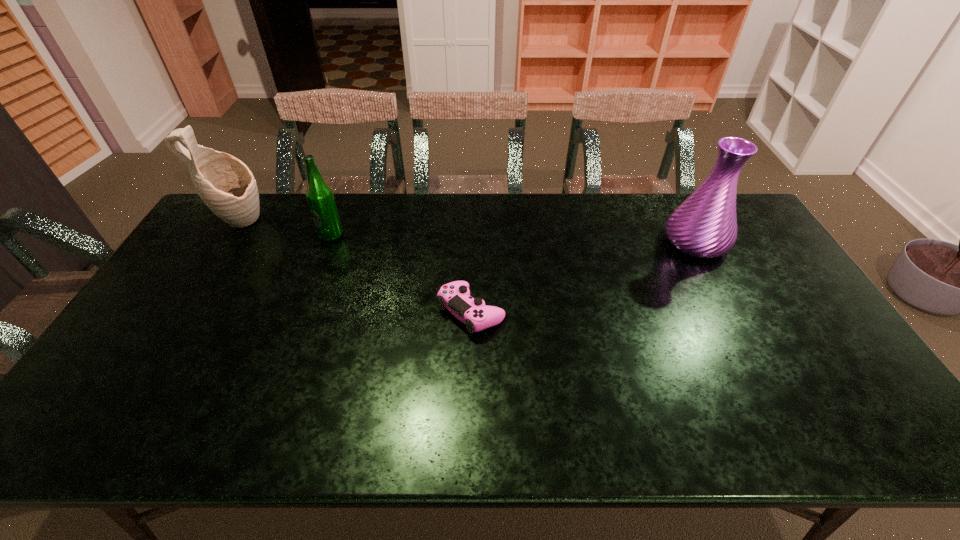
Identify the location of free space between the leftmost object and the second object from left to right. (285, 229).

The height and width of the screenshot is (540, 960). I want to click on vacant point located between the nearest object and the beer bottle, so click(x=401, y=274).

Find the location of a particular element. The height and width of the screenshot is (540, 960). object that is the nearest to the pitcher is located at coordinates (319, 196).

Choose which object is the nearest neighbor to the control. Please provide its 2D coordinates. Your answer should be formatted as a tuple, i.e. [(x, y)], where the tuple contains the x and y coordinates of a point satisfying the conditions above.

[(319, 196)]

At what (x,y) coordinates should I click in order to perform the action: click on vacant space that satisfies the following two spatial constraints: 1. on the label of the rightmost object; 2. on the left side of the beer bottle. Please return your answer as a coordinate pair (x, y). This screenshot has width=960, height=540. Looking at the image, I should click on (329, 242).

This screenshot has width=960, height=540. I want to click on vacant space that satisfies the following two spatial constraints: 1. on the back side of the vase; 2. on the left side of the control, so click(472, 242).

Locate an element on the screen. The height and width of the screenshot is (540, 960). vacant space that satisfies the following two spatial constraints: 1. at the spout of the pitcher; 2. on the right side of the nearest object is located at coordinates (184, 312).

At what (x,y) coordinates should I click in order to perform the action: click on vacant space that satisfies the following two spatial constraints: 1. on the label of the beer bottle; 2. on the right side of the vase. Please return your answer as a coordinate pair (x, y). This screenshot has width=960, height=540. Looking at the image, I should click on (329, 242).

Find the location of a particular element. vacant position in the image that satisfies the following two spatial constraints: 1. on the label of the second object from left to right; 2. on the left side of the rightmost object is located at coordinates (329, 242).

This screenshot has width=960, height=540. What are the coordinates of `vacant point that satisfies the following two spatial constraints: 1. at the spout of the shortest object; 2. on the left side of the leftmost object` in the screenshot? It's located at (184, 312).